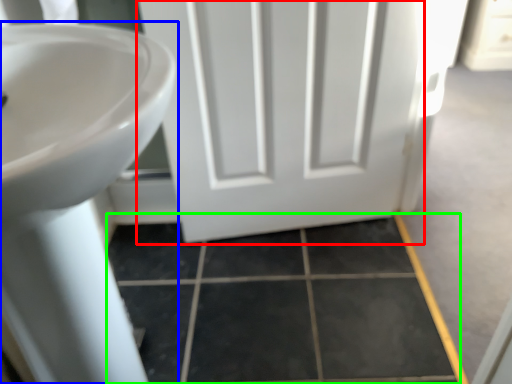
Question: Considering the real-world distances, which object is closest to door (highlighted by a red box)? sink (highlighted by a blue box) or tile (highlighted by a green box).

Choices:
 (A) sink
 (B) tile

Answer: (B)